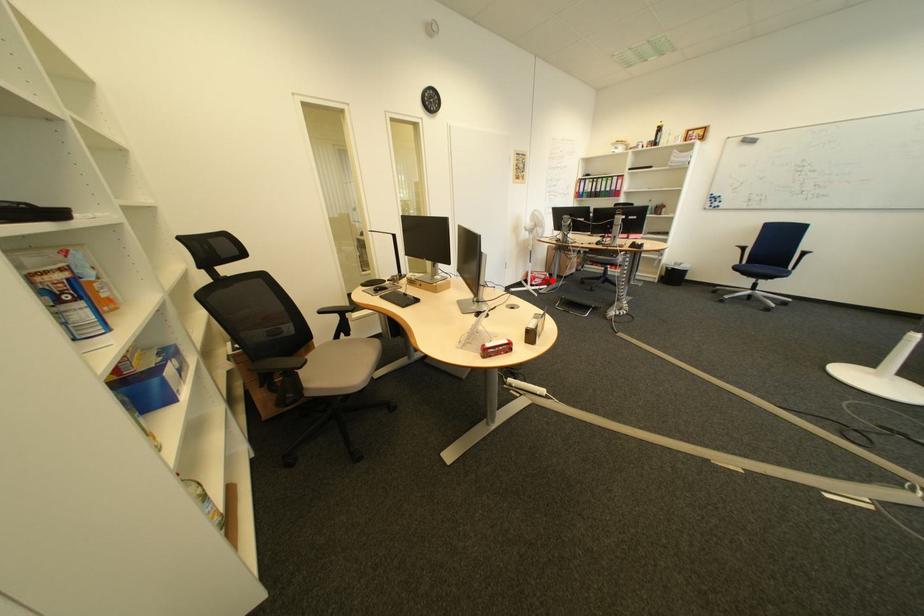
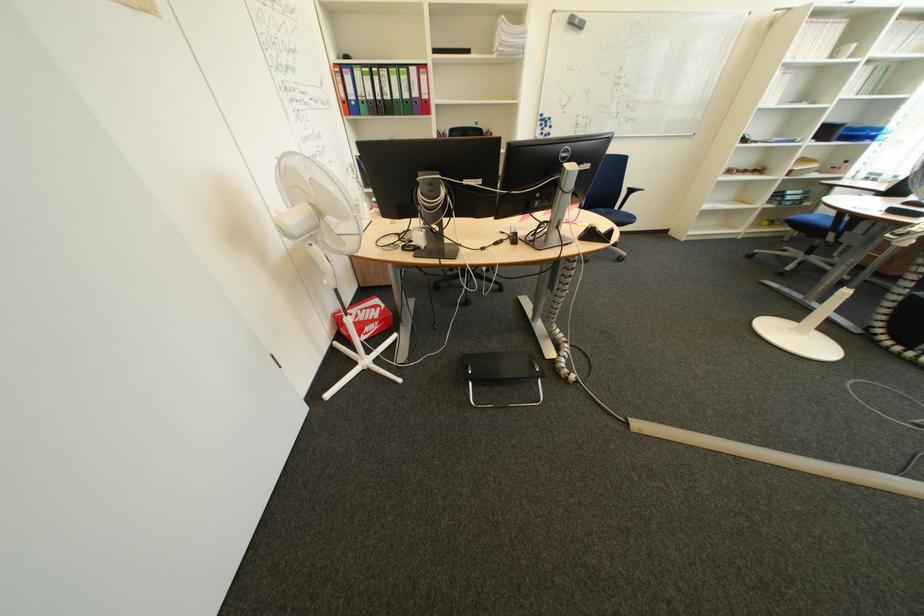
Where in the second image is the point corresponding to the highlighted location from the first image?

(385, 326)